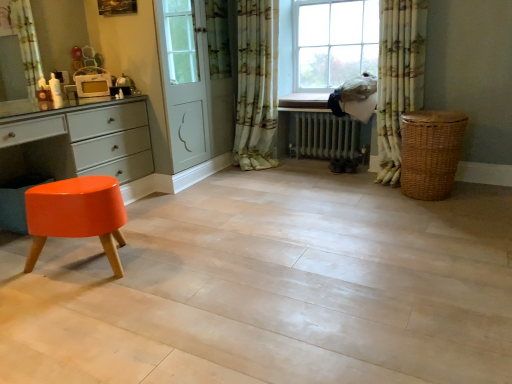
Where is `free space in front of woven brown basket at right`? Image resolution: width=512 pixels, height=384 pixels. free space in front of woven brown basket at right is located at coordinates click(x=426, y=216).